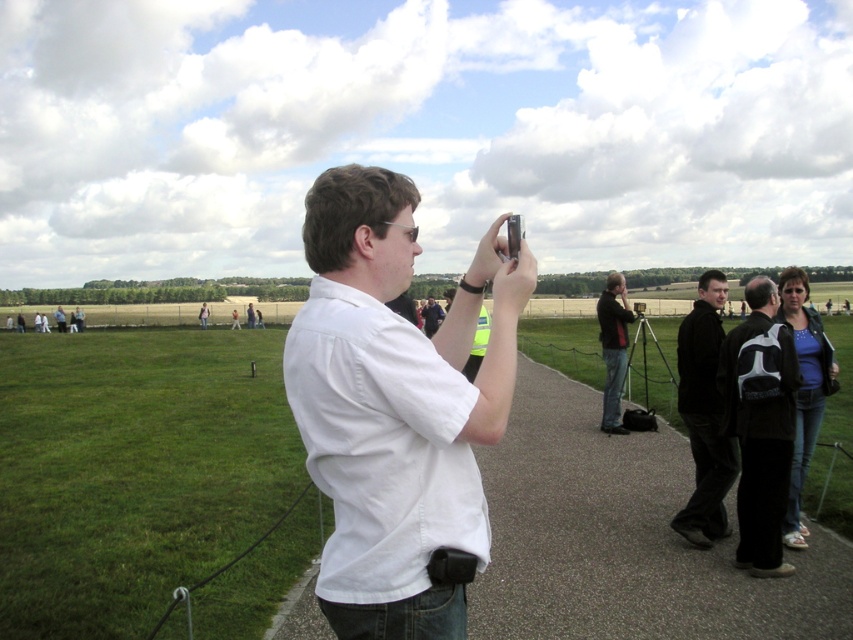
You are standing on the paved pathway and want to walk towards the black matte jacket at lower right. Which direction should you turn to face the white matte shirt at center before walking?

You should turn to your left to face the white matte shirt at center, which is to the left of the black matte jacket at lower right, before walking towards it.

You are a hiker who needs to decide which item to place on a narrow shelf that can only hold items shorter than 12 inches. You have the black backpack at center right and the black matte jacket at lower right. Which item should you choose?

The black backpack at center right is not as tall as the black matte jacket at lower right, so the black backpack at center right is shorter and should be chosen for the narrow shelf.